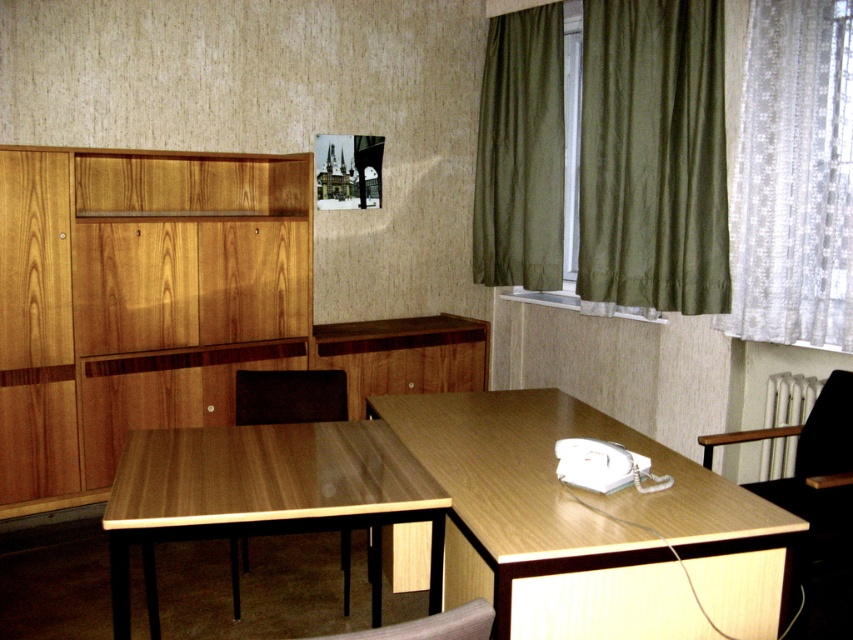
You are an office worker who wants to let more natural light into the room. You see the white lace curtain at right and the olive drab curtain at upper right. Which curtain should you open first to allow more light in?

The white lace curtain at right should be opened first because it is positioned under the olive drab curtain at upper right, so opening the lower one first would allow more light to pass through both curtains.

You are organizing a photoshoot in this office and need to decide which curtain to use for lighting control. The white lace curtain at right allows some light diffusion, while the olive drab curtain at upper right is more opaque. Considering their sizes, which curtain would block more light?

The olive drab curtain at upper right is larger in size than the white lace curtain at right, so it would block more light due to its greater surface area.